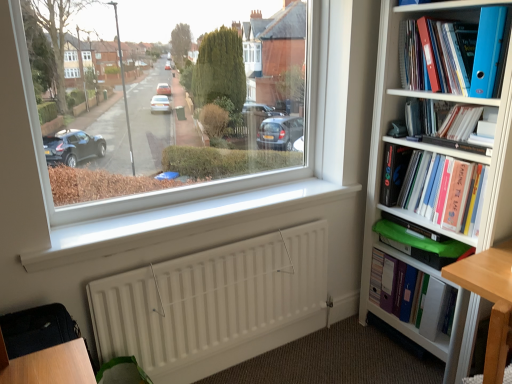
Question: Based on their sizes in the image, would you say hardcover book at upper right, placed as the third book when sorted from bottom to top, is bigger or smaller than white smooth window sill at center?

Choices:
 (A) big
 (B) small

Answer: (B)

Question: Is point (456, 124) positioned closer to the camera than point (144, 223)?

Choices:
 (A) farther
 (B) closer

Answer: (A)

Question: Which is farther from the blue plastic folder at upper right?

Choices:
 (A) white matte radiator at lower center
 (B) blue plastic folder at upper right, which is counted as the first book, starting from the top
 (C) hardcover book at upper right, positioned as the second book in top-to-bottom order
 (D) white smooth window sill at center
 (E) green plastic case at lower right, the 1th book in the bottom-to-top sequence

Answer: (A)

Question: Based on their relative distances, which object is farther from the blue plastic folder at upper right, which is counted as the first book, starting from the top?

Choices:
 (A) white smooth window sill at center
 (B) white glossy bookcase at right
 (C) hardcover book at right, the 3th book in the top-to-bottom sequence
 (D) white matte radiator at lower center
 (E) hardcover book at upper right, positioned as the second book in top-to-bottom order

Answer: (D)